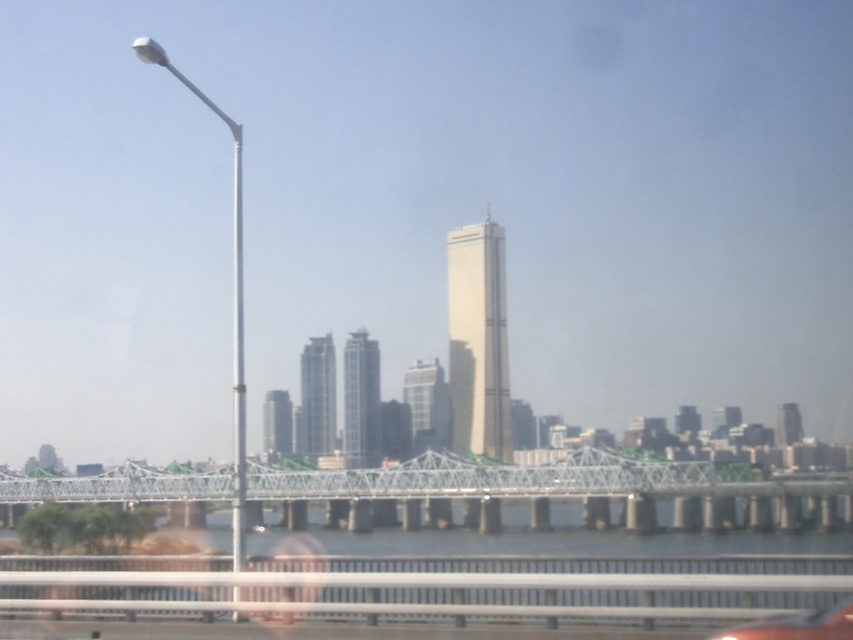
You are a photographer standing on the shore of the river. You want to take a photo that includes both the metallic gray bridge at center and the metallic silver car at lower center. Which object will appear larger in the photo?

The metallic gray bridge at center will appear larger in the photo because it has a greater height compared to the metallic silver car at lower center.

You are standing on the riverbank and see the metallic gray bridge at center and the metallic silver car at lower center. Which object is closer to you?

The metallic gray bridge at center is closer to you because it is positioned further to the viewer than the metallic silver car at lower center.

You are a photographer trying to capture the entire metallic gray bridge at center and metallic silver car at lower center in one shot. Given that your camera has a limited field of view, which object should you prioritize framing first to ensure both are visible?

The metallic gray bridge at center has a larger size compared to the metallic silver car at lower center, so you should prioritize framing the metallic gray bridge at center first to ensure both are visible in the shot.